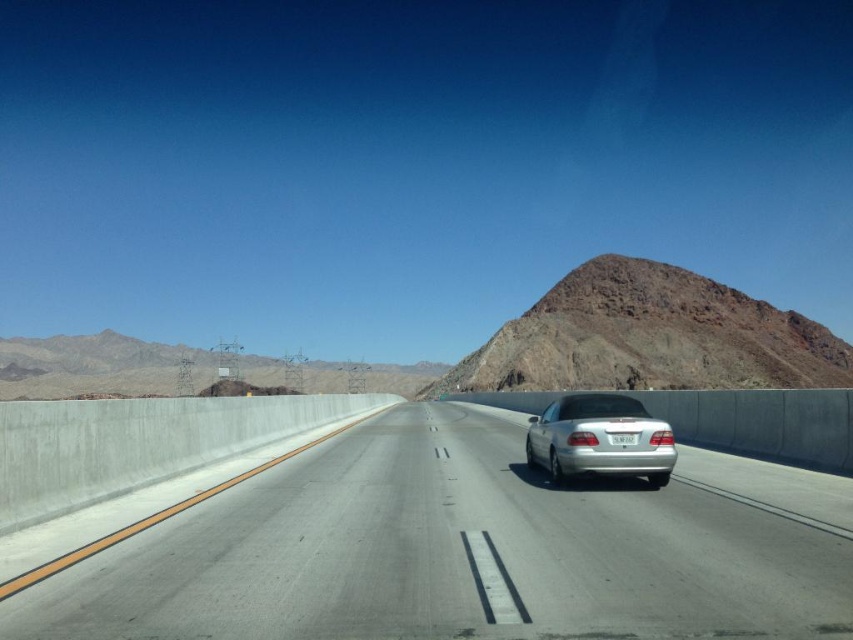
In the scene shown: Can you confirm if silver metallic car at center is smaller than rugged brown rock at upper right?

Yes.

Who is lower down, silver metallic car at center or rugged brown rock at upper right?

rugged brown rock at upper right

Who is more distant from viewer, (439, 506) or (694, 314)?

The point (694, 314) is behind.

Where is `silver metallic car at center`? silver metallic car at center is located at coordinates (468, 548).

Is rugged brown rock at upper right shorter than rugged rock mountain at upper center?

No, rugged brown rock at upper right is not shorter than rugged rock mountain at upper center.

Is rugged brown rock at upper right thinner than rugged rock mountain at upper center?

Correct, rugged brown rock at upper right's width is less than rugged rock mountain at upper center's.

This screenshot has width=853, height=640. I want to click on rugged brown rock at upper right, so click(x=650, y=337).

Can you confirm if silver metallic car at center is positioned above silver metallic sedan at center?

Yes, silver metallic car at center is above silver metallic sedan at center.

Measure the distance between point [672,579] and camera.

A distance of 6.15 meters exists between point [672,579] and camera.

The image size is (853, 640). Describe the element at coordinates (468, 548) in the screenshot. I see `silver metallic car at center` at that location.

The width and height of the screenshot is (853, 640). Identify the location of silver metallic car at center. (468, 548).